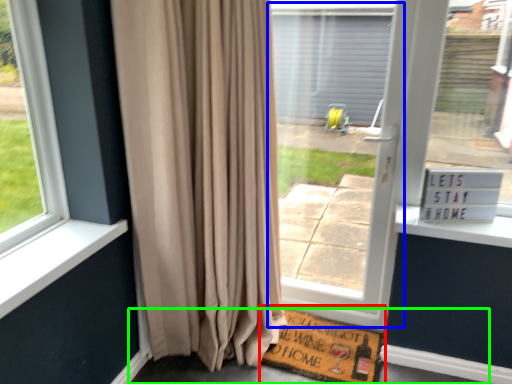
Question: Which is nearer to the doormat (highlighted by a red box)? screen door (highlighted by a blue box) or pavement (highlighted by a green box).

Choices:
 (A) screen door
 (B) pavement

Answer: (B)